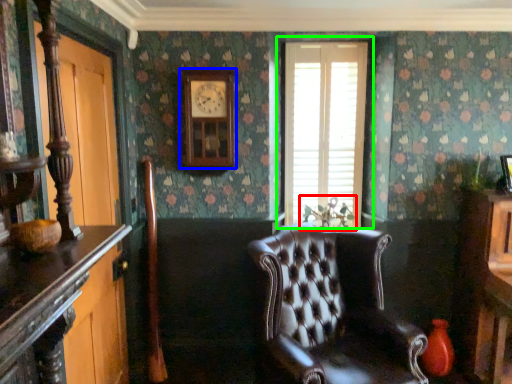
Question: Which object is positioned closest to plant (highlighted by a red box)? Select from clock (highlighted by a blue box) and window (highlighted by a green box).

Choices:
 (A) clock
 (B) window

Answer: (B)